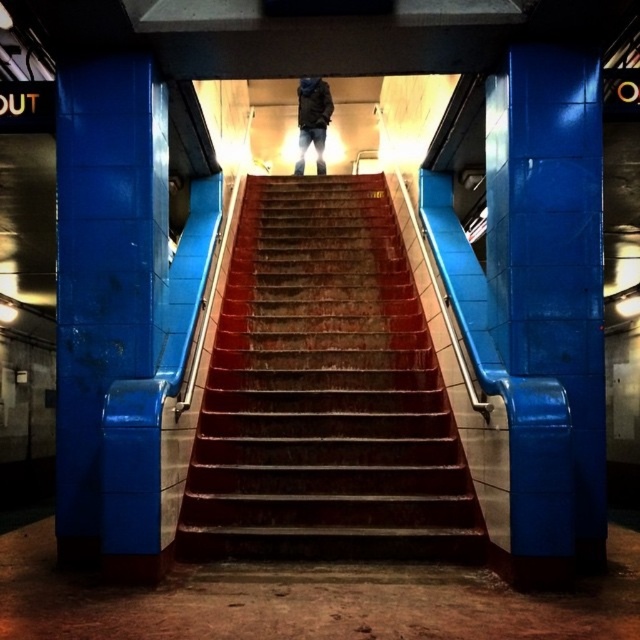
Is blue glossy pillar at left below dark gray jacket at center?

Yes, blue glossy pillar at left is below dark gray jacket at center.

Image resolution: width=640 pixels, height=640 pixels. What do you see at coordinates (100, 268) in the screenshot?
I see `blue glossy pillar at left` at bounding box center [100, 268].

The image size is (640, 640). Describe the element at coordinates (100, 268) in the screenshot. I see `blue glossy pillar at left` at that location.

Where is `blue glossy pillar at left`? Image resolution: width=640 pixels, height=640 pixels. blue glossy pillar at left is located at coordinates (100, 268).

Does point (323, 228) come farther from viewer compared to point (328, 90)?

That is False.

Can you confirm if rusty metal stairs at center is positioned above dark gray jacket at center?

No, rusty metal stairs at center is not above dark gray jacket at center.

Image resolution: width=640 pixels, height=640 pixels. Describe the element at coordinates (324, 394) in the screenshot. I see `rusty metal stairs at center` at that location.

At what (x,y) coordinates should I click in order to perform the action: click on rusty metal stairs at center. Please return your answer as a coordinate pair (x, y). Image resolution: width=640 pixels, height=640 pixels. Looking at the image, I should click on (x=324, y=394).

Does blue glossy pillar at right have a greater height compared to blue glossy pillar at left?

Correct, blue glossy pillar at right is much taller as blue glossy pillar at left.

Is point (548, 316) less distant than point (68, 397)?

Yes, point (548, 316) is closer to viewer.

Does point (499, 147) come farther from viewer compared to point (106, 202)?

Yes.

You are a GUI agent. You are given a task and a screenshot of the screen. Output one action in this format:
    pyautogui.click(x=<x>, y=<y>)
    Task: Click on the blue glossy pillar at right
    This screenshot has width=640, height=640.
    Given the screenshot: What is the action you would take?
    pyautogui.click(x=554, y=256)